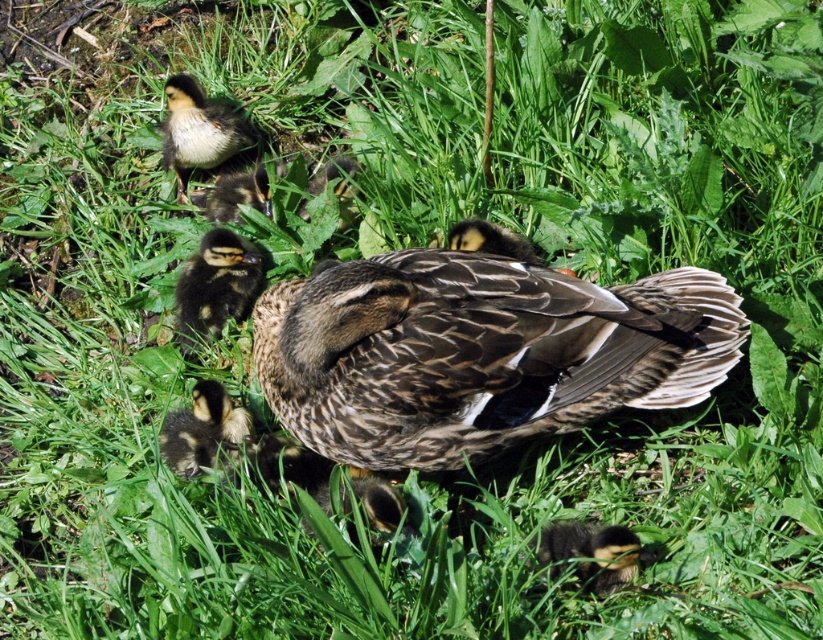
Consider the image. You are a photographer trying to capture the brown speckled feathers at center in the image. If you want to focus on the exact center of the image, which is at point 0.5,0.5, would you need to adjust your camera upwards or downwards? Please explain based on the coordinates provided.

The brown speckled feathers at center are located at coordinates (x=479, y=353). The exact center of the image is at (x=411, y=320). Since the y coordinate of the feathers is 0.583, which is higher than 0.5, the feathers are slightly above the center. To focus on the exact center, you would need to adjust the camera downwards to bring the feathers into the central point.

You are a wildlife photographer observing the duck family. You notice two ducklings, the dark brown fluffy duckling at center and the brown fuzzy duckling at center. Which duckling is located directly below the other?

The dark brown fluffy duckling at center is positioned under the brown fuzzy duckling at center, so the dark brown fluffy duckling at center is directly below the brown fuzzy duckling at center.